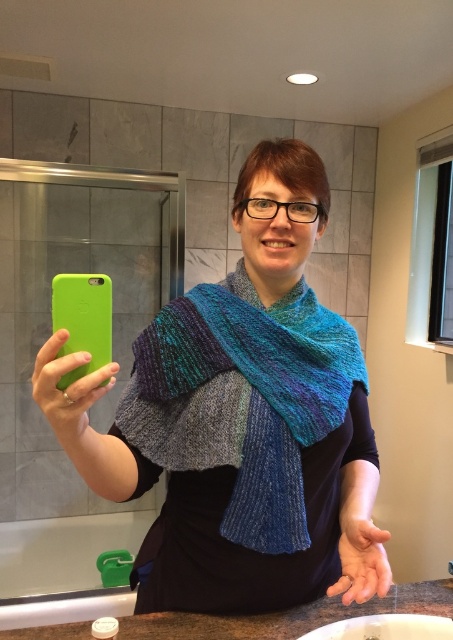
You are a photographer trying to capture the knitted wool scarf at center in the bathroom scene. The bathroom has a mirror on the wall. Where should you position yourself relative to the mirror to ensure the scarf is fully visible in the reflection?

To capture the knitted wool scarf at center in the mirror reflection, position yourself so that the scarf is directly in front of the mirror at point (242, 397). This ensures the reflection will show the scarf clearly.

You are trying to take a selfie in the bathroom mirror. You have a knitted wool scarf at center and a granite countertop at lower center in the frame. Which object will appear closer to the camera in the photo?

The knitted wool scarf at center will appear closer to the camera in the photo because it is in front of the granite countertop at lower center.